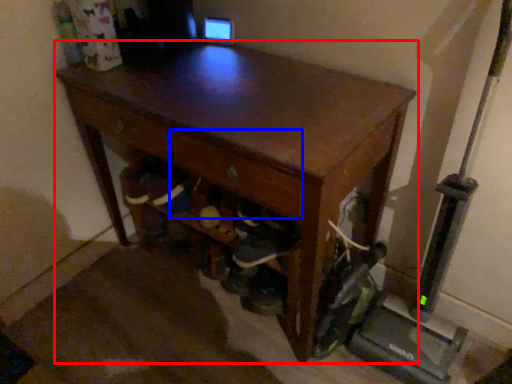
Question: Which point is closer to the camera, desk (highlighted by a red box) or drawer (highlighted by a blue box)?

Choices:
 (A) desk
 (B) drawer

Answer: (A)